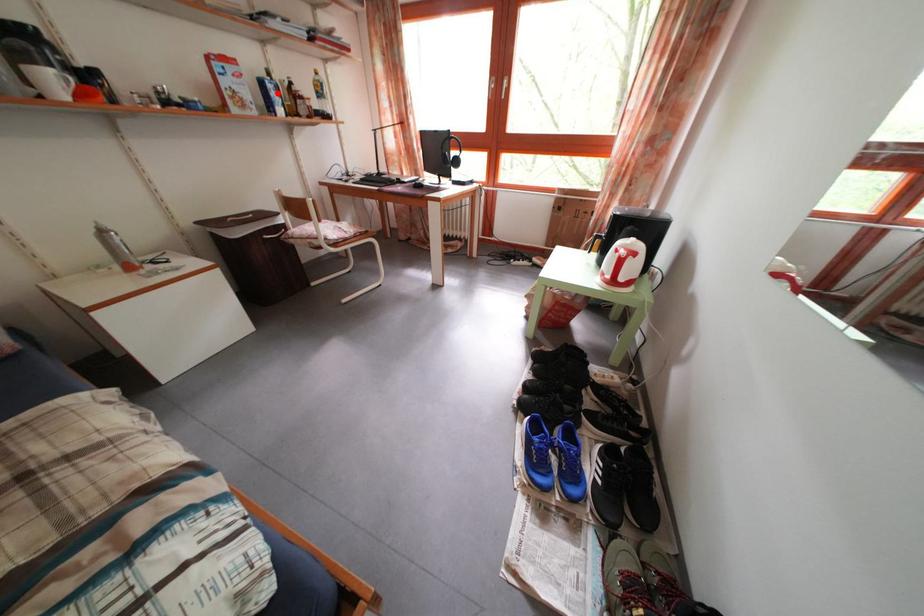
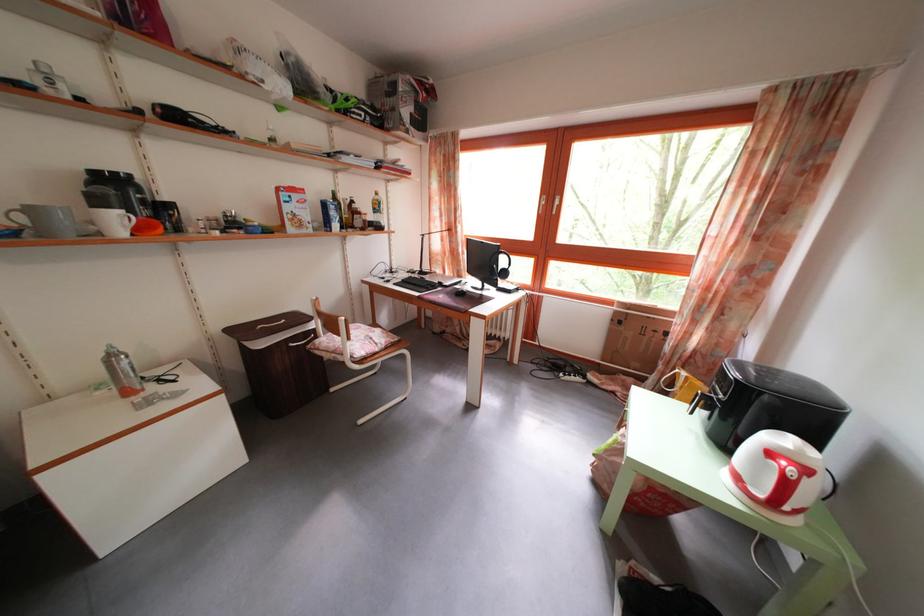
Question: I am providing you with two images of the same scene from different viewpoints. A red point is marked on the first image. Is the red point's position out of view in image 2?

Choices:
 (A) Yes
 (B) No

Answer: (B)